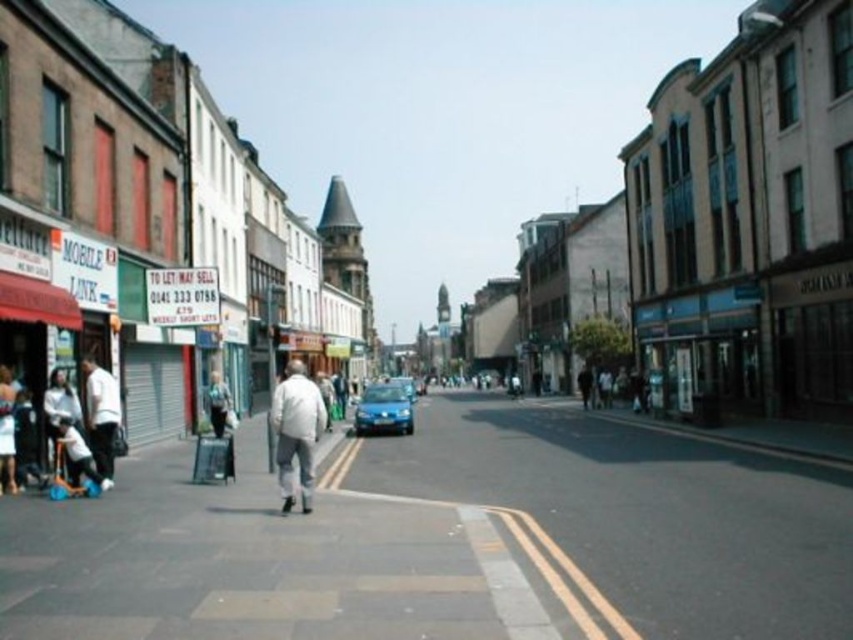
You are standing at the point marked as point (111,444) and want to walk to the point marked as point (283,500). Which direction should you move to get closer to your destination?

You should move away from the camera because point (283,500) is closer to the camera than point (111,444).

You are a delivery person standing at the edge of the street. You need to deliver a package to a person wearing a white matte jacket at center and another to someone wearing a light blue denim jacket at center. The delivery robot you have can carry both packages but can only move in a straight line. Given that the robot has a maximum delivery range of 40 feet, will it be able to deliver both packages without needing to recharge?

The white matte jacket at center and light blue denim jacket at center are 36.07 feet apart from each other. Since the robot can travel up to 40 feet, it has enough range to deliver both packages in a straight line without needing to recharge.

You are a delivery person trying to cross the street to deliver a package. There is a white matte jacket at center and a satin blue car at center in your path. Which object is larger and might block your path more?

The white matte jacket at center is bigger than the satin blue car at center, so it might block your path more.